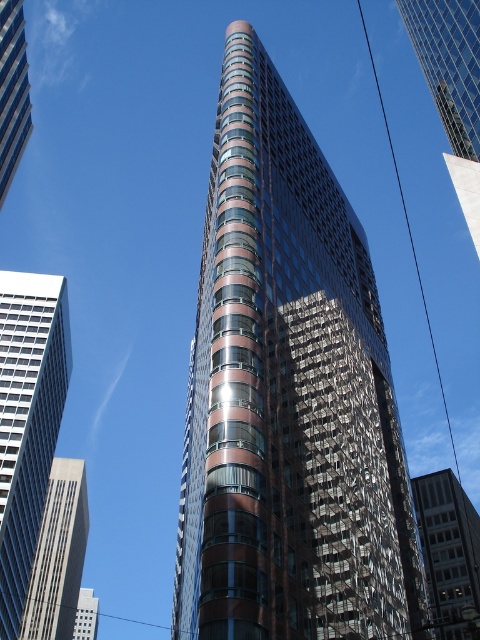
Question: Is brown glass skyscraper at center above brown glass building at center?

Choices:
 (A) no
 (B) yes

Answer: (B)

Question: Among these objects, which one is nearest to the camera?

Choices:
 (A) brown glass building at center
 (B) glassy reflective building at center

Answer: (B)

Question: Which point is closer to the camera?

Choices:
 (A) (69, 532)
 (B) (435, 19)
 (C) (12, 52)

Answer: (B)

Question: From the image, what is the correct spatial relationship of white glass skyscraper at left in relation to matte glass skyscraper at left?

Choices:
 (A) left
 (B) right

Answer: (A)

Question: Is brown glass skyscraper at center above matte glass skyscraper at left?

Choices:
 (A) no
 (B) yes

Answer: (A)

Question: Among these objects, which one is nearest to the camera?

Choices:
 (A) brown glass skyscraper at center
 (B) matte glass skyscraper at left
 (C) gray concrete skyscraper at left

Answer: (A)